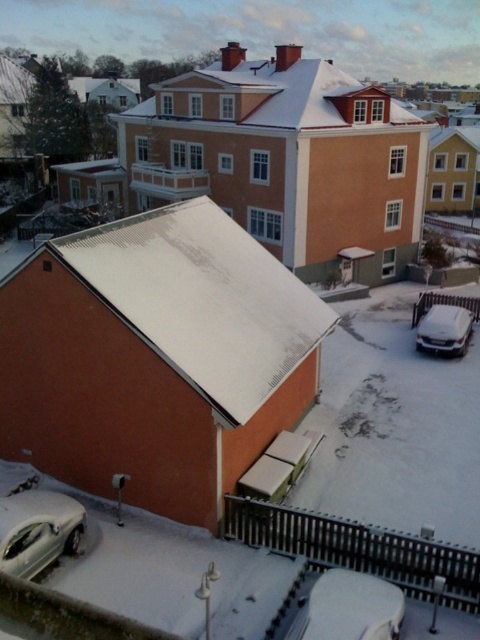
You are a delivery person trying to park your van between the white matte car at lower center and the silver metallic car at lower left. The van is 6 meters long. Can you fit it in the space between them?

The white matte car at lower center is smaller than the silver metallic car at lower left, but the exact distance between them isn

You are standing in the winter scene and want to know the distance to the point marked as point (x=322, y=618). Can you tell me how far it is from where I am standing?

The point (x=322, y=618) is 12.02 meters away from the viewer.